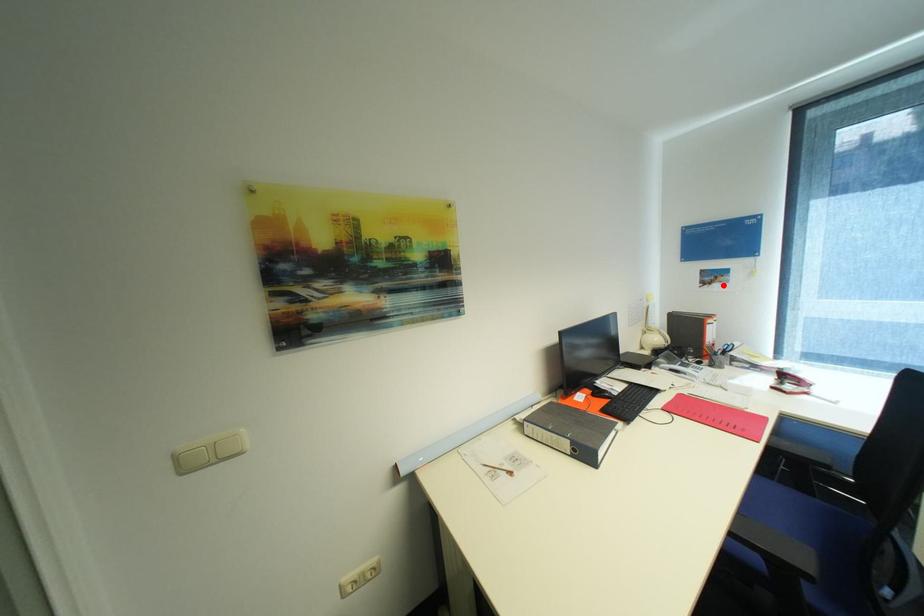
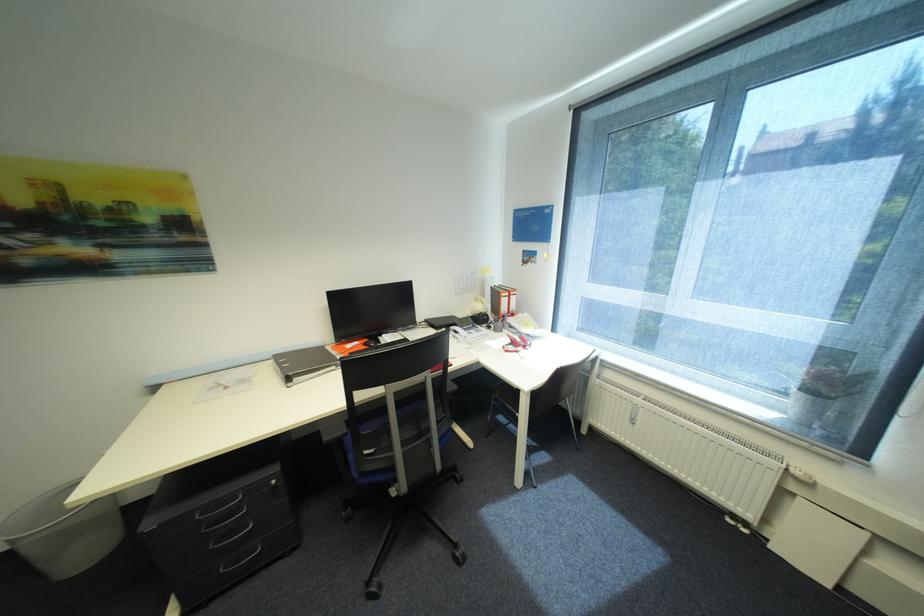
In the second image, find the point that corresponds to the highlighted location in the first image.

(537, 265)